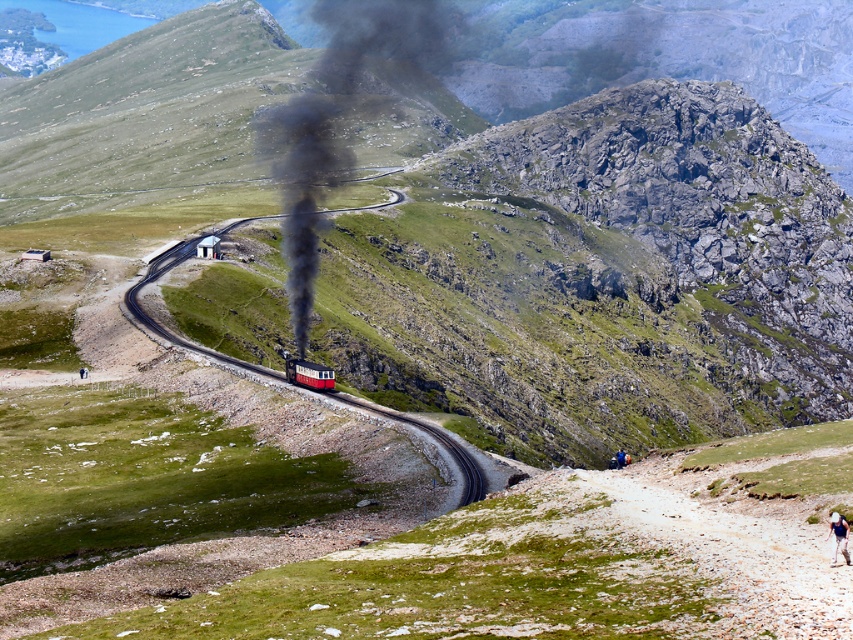
You are standing at the point marked as point (738,545) in the image. Looking towards the steam train, which direction should you walk to reach the nearest railway track?

The point (738,545) is located at the green mossy dirt path at lower right. To reach the nearest railway track, you should walk towards the upper left direction since the steam train is centrally positioned and moving towards you, indicating the track is in that direction.